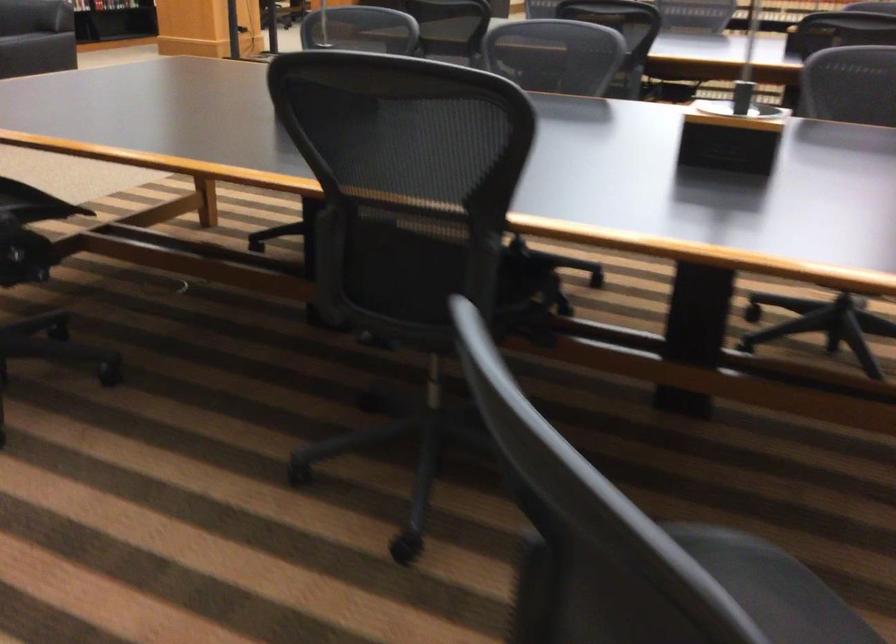
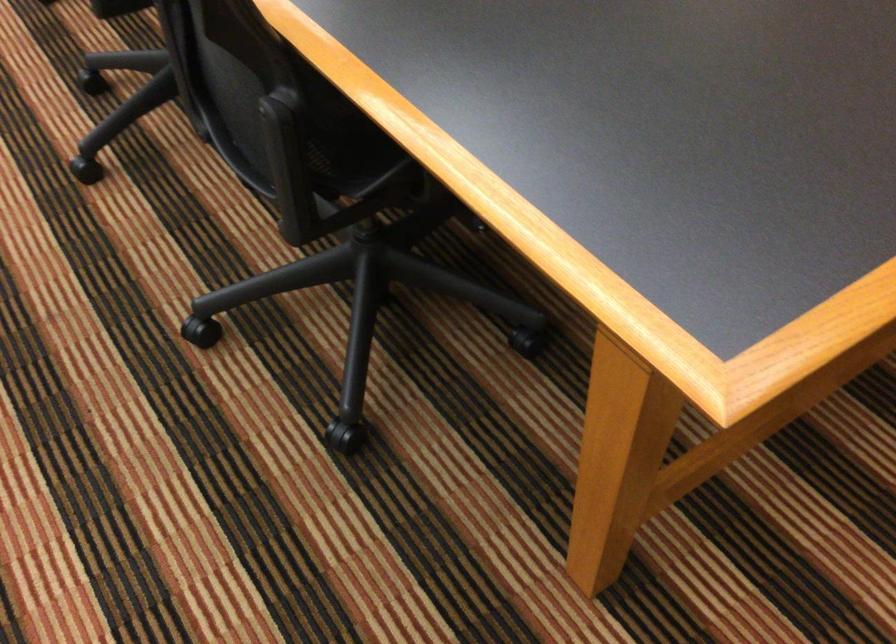
Locate, in the second image, the point that corresponds to (583,289) in the first image.

(91, 82)